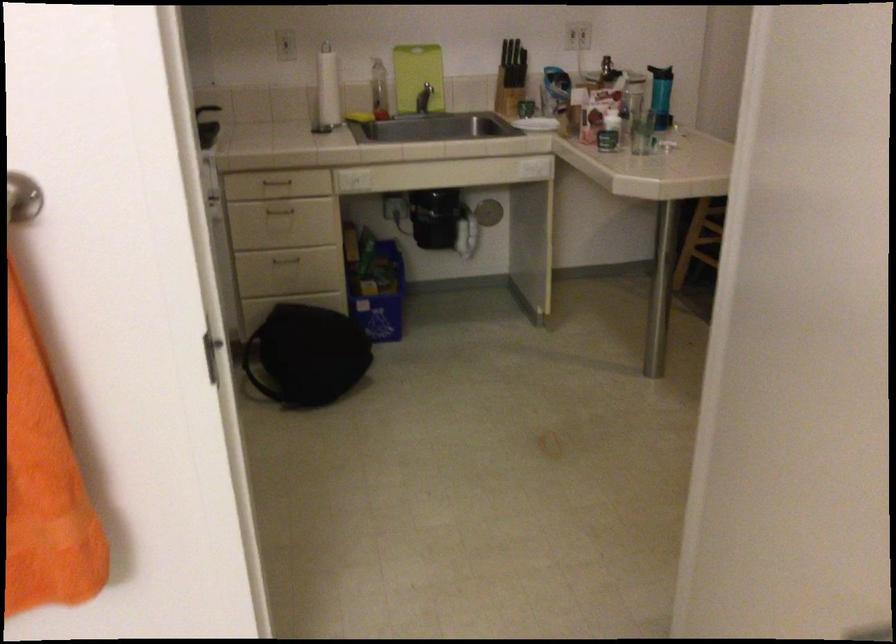
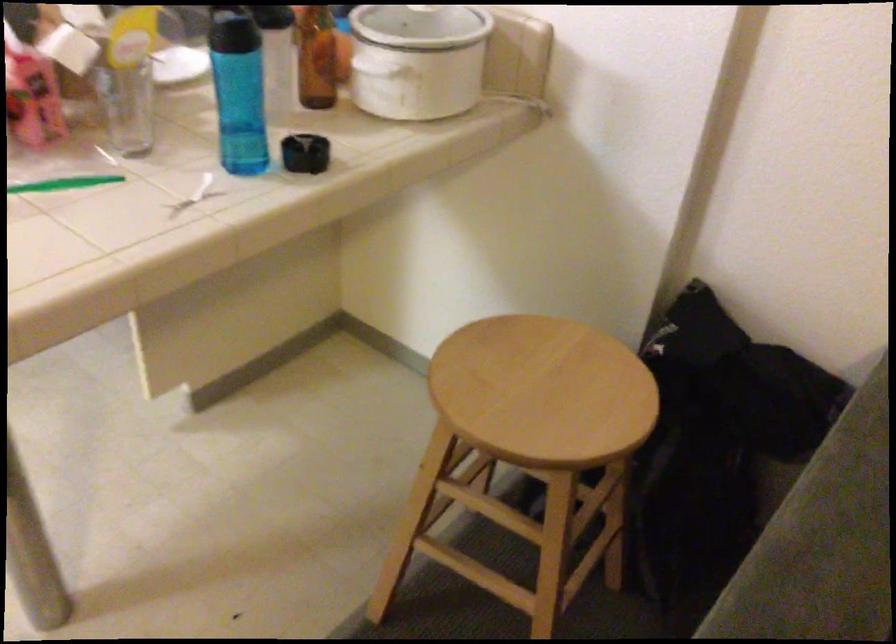
Locate, in the second image, the point that corresponds to (597,120) in the first image.

(127, 106)